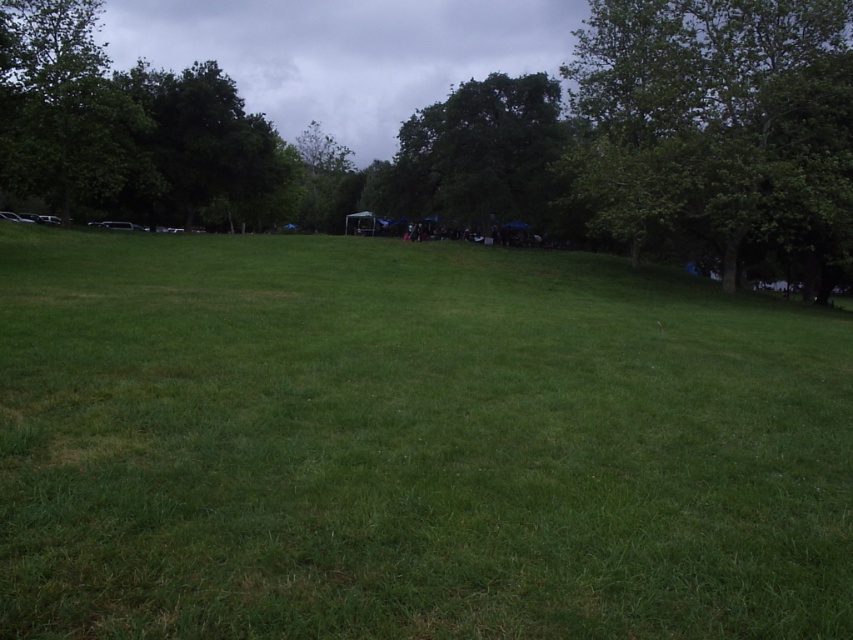
You are standing at the origin point in the image, which is the bottom left corner. You want to walk to the green grass at center. In which direction should you move first?

Since the green grass at center is located at coordinates approximately 0.694 on the x axis and 0.482 on the y axis, you should first move to the right along the x axis to reach the green grass at center.